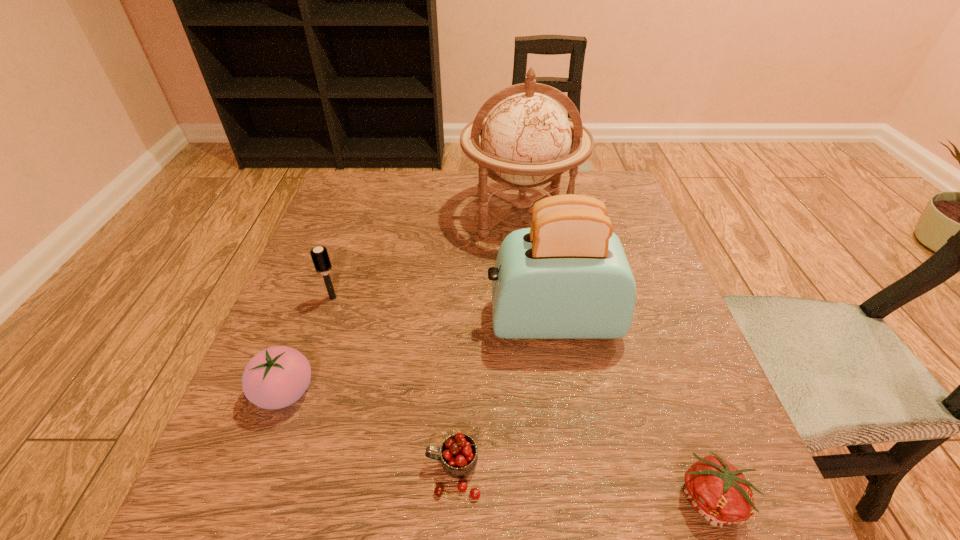
At what (x,y) coordinates should I click in order to perform the action: click on vacant space at the near edge of the desktop. Please return your answer as a coordinate pair (x, y). This screenshot has height=540, width=960. Looking at the image, I should click on (528, 500).

Image resolution: width=960 pixels, height=540 pixels. I want to click on vacant space at the left edge of the desktop, so click(339, 370).

Find the location of a particular element. The image size is (960, 540). vacant space at the right edge of the desktop is located at coordinates (692, 405).

This screenshot has height=540, width=960. Find the location of `free region at the far left corner`. free region at the far left corner is located at coordinates click(341, 198).

Where is `free space at the far right corner of the desktop`? This screenshot has height=540, width=960. free space at the far right corner of the desktop is located at coordinates (586, 179).

Find the location of `free area in between the third nearest object and the tallest object`. free area in between the third nearest object and the tallest object is located at coordinates (403, 303).

Find the location of a particular element. The width and height of the screenshot is (960, 540). unoccupied area between the tallest object and the third nearest object is located at coordinates (403, 303).

Where is `unoccupied position between the toaster and the fourth shortest object`? The image size is (960, 540). unoccupied position between the toaster and the fourth shortest object is located at coordinates (443, 309).

Locate an element on the screen. The width and height of the screenshot is (960, 540). unoccupied position between the second tallest object and the hairbrush is located at coordinates (443, 309).

Identify the location of free area in between the taller tomato and the shorter tomato. The image size is (960, 540). (499, 446).